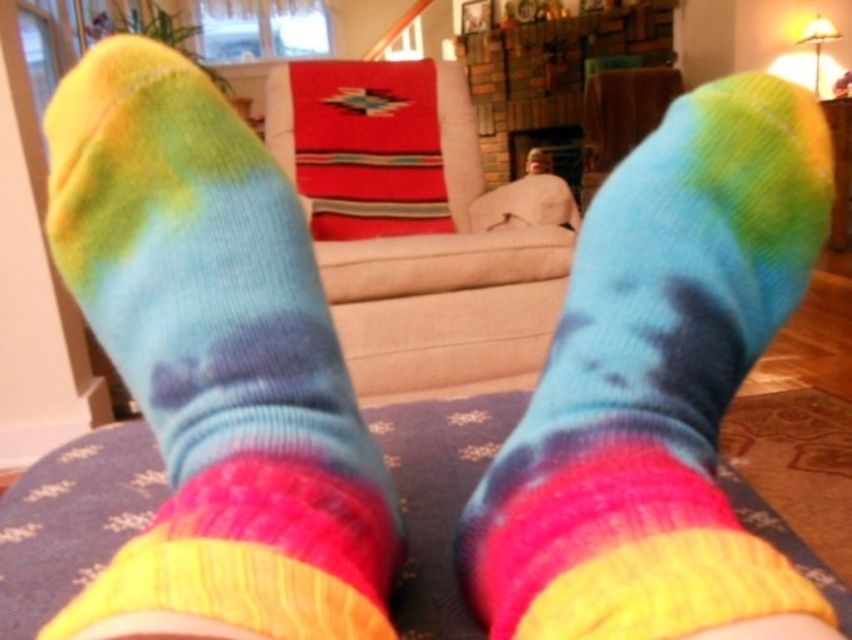
Consider the image. Is tie-dye fabric sock at center wider than textured blue mat at center?

No.

Which is behind, point (632, 358) or point (749, 513)?

The point (749, 513) is more distant.

Find the location of a particular element. The image size is (852, 640). tie-dye fabric sock at center is located at coordinates (657, 381).

Between tie-dye knit sock at center and textured blue mat at center, which one has less height?

textured blue mat at center is shorter.

The image size is (852, 640). What do you see at coordinates (216, 358) in the screenshot? I see `tie-dye knit sock at center` at bounding box center [216, 358].

Describe the element at coordinates (216, 358) in the screenshot. This screenshot has width=852, height=640. I see `tie-dye knit sock at center` at that location.

Where is `tie-dye knit sock at center`? This screenshot has height=640, width=852. tie-dye knit sock at center is located at coordinates (216, 358).

Between tie-dye knit sock at center and tie-dye fabric sock at center, which one appears on the left side from the viewer's perspective?

Positioned to the left is tie-dye knit sock at center.

Does tie-dye knit sock at center have a lesser height compared to tie-dye fabric sock at center?

Incorrect, tie-dye knit sock at center's height does not fall short of tie-dye fabric sock at center's.

Is point (170, 410) closer to camera compared to point (695, 264)?

Yes, it is in front of point (695, 264).

The width and height of the screenshot is (852, 640). In order to click on tie-dye knit sock at center in this screenshot , I will do `click(216, 358)`.